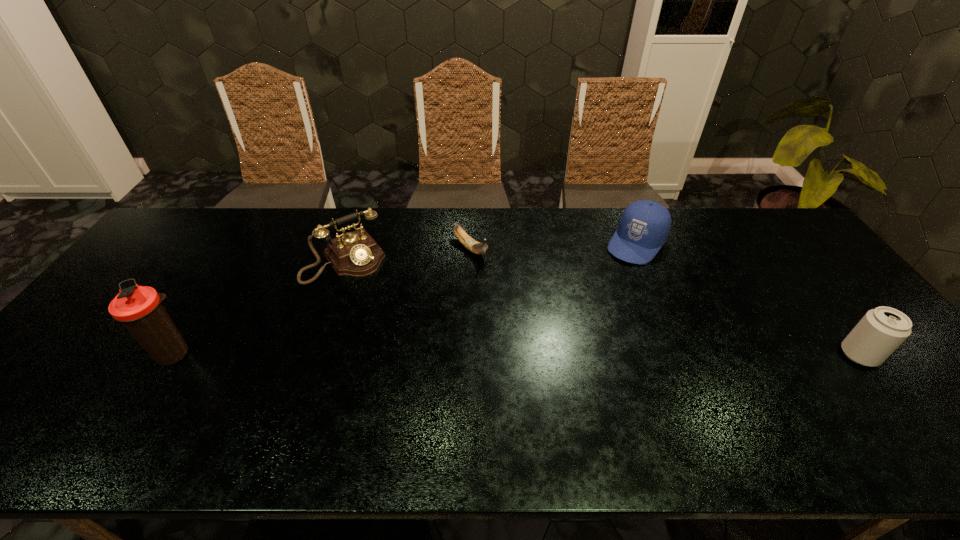
Locate an element on the screen. the leftmost object is located at coordinates (139, 309).

In order to click on thermos bottle in this screenshot , I will do `click(139, 309)`.

In order to click on can in this screenshot , I will do `click(882, 330)`.

The width and height of the screenshot is (960, 540). I want to click on telephone, so pyautogui.click(x=356, y=254).

This screenshot has height=540, width=960. I want to click on the shortest object, so click(472, 245).

Locate an element on the screen. This screenshot has height=540, width=960. the third object from left to right is located at coordinates (472, 245).

You are a GUI agent. You are given a task and a screenshot of the screen. Output one action in this format:
    pyautogui.click(x=<x>, y=<y>)
    Task: Click on the fourth object from left to right
    The image size is (960, 540).
    Given the screenshot: What is the action you would take?
    pyautogui.click(x=644, y=226)

What are the coordinates of `vacant space located 0.140m on the back of the leftmost object` in the screenshot? It's located at (207, 300).

The height and width of the screenshot is (540, 960). What are the coordinates of `free point located 0.050m on the back of the can` in the screenshot? It's located at (837, 326).

At what (x,y) coordinates should I click in order to perform the action: click on vacant area situated 0.360m on the dial of the telephone. Please return your answer as a coordinate pair (x, y). The height and width of the screenshot is (540, 960). Looking at the image, I should click on (423, 362).